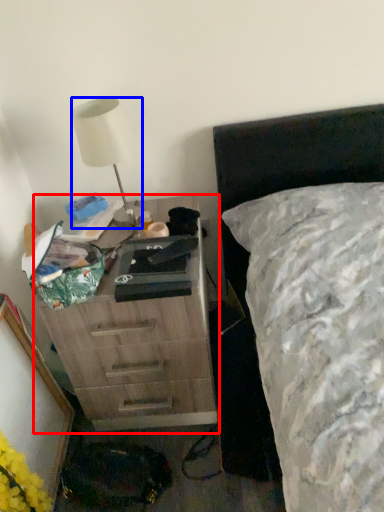
Question: Which object is further to the camera taking this photo, chest of drawers (highlighted by a red box) or lamp (highlighted by a blue box)?

Choices:
 (A) chest of drawers
 (B) lamp

Answer: (B)